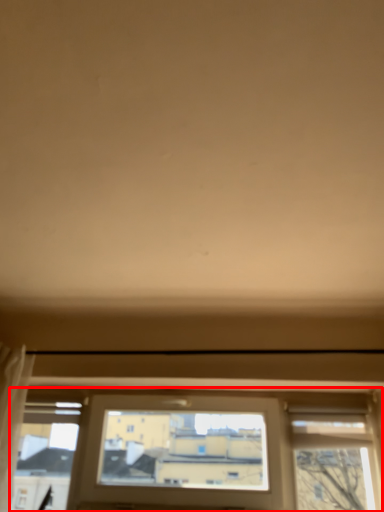
Question: From the image's perspective, where is window (annotated by the red box) located in relation to curtain in the image?

Choices:
 (A) above
 (B) below

Answer: (B)